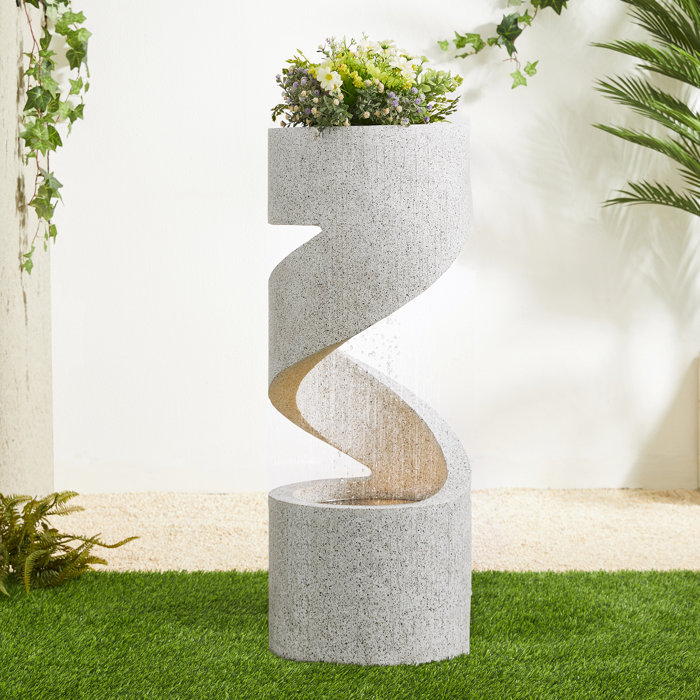
What are the coordinates of `white wall` in the screenshot? It's located at (203, 290).